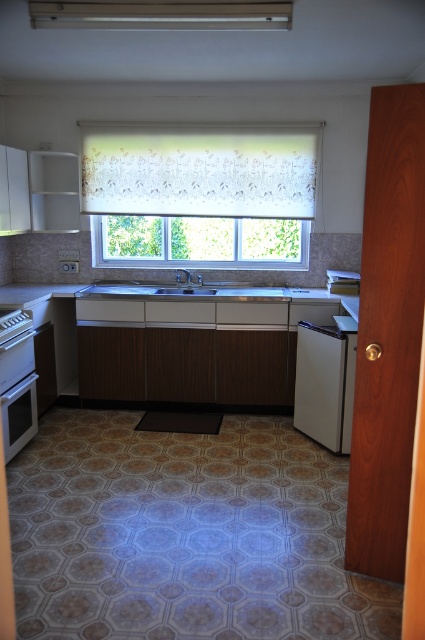
What do you see at coordinates (325, 381) in the screenshot? I see `satin white dishwasher at right` at bounding box center [325, 381].

At what (x,y) coordinates should I click in order to perform the action: click on satin white dishwasher at right. Please return your answer as a coordinate pair (x, y). The width and height of the screenshot is (425, 640). Looking at the image, I should click on click(x=325, y=381).

Which of these two, white floral roller shade at center or matte silver oven at left, stands shorter?

With less height is matte silver oven at left.

Who is lower down, white floral roller shade at center or matte silver oven at left?

matte silver oven at left is lower down.

Find the location of `white floral roller shade at center`. white floral roller shade at center is located at coordinates (200, 193).

Which of these two, matte white exhaust hood at upper center or matte silver oven at left, stands taller?

With more height is matte silver oven at left.

Is matte white exhaust hood at upper center wider than matte silver oven at left?

Correct, the width of matte white exhaust hood at upper center exceeds that of matte silver oven at left.

This screenshot has width=425, height=640. What do you see at coordinates (161, 13) in the screenshot?
I see `matte white exhaust hood at upper center` at bounding box center [161, 13].

Locate an element on the screen. matte white exhaust hood at upper center is located at coordinates (161, 13).